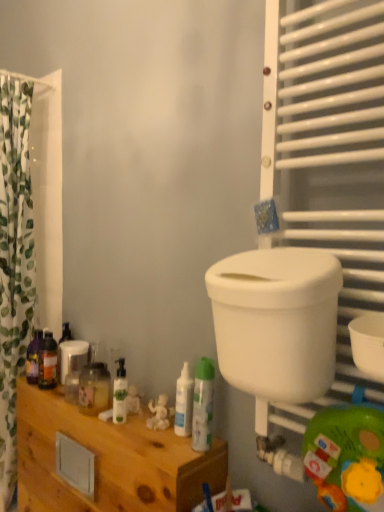
Find the location of a particular element. free location to the left of white glossy spray can at center, arranged as the 5th toiletry when viewed from the back is located at coordinates (157, 439).